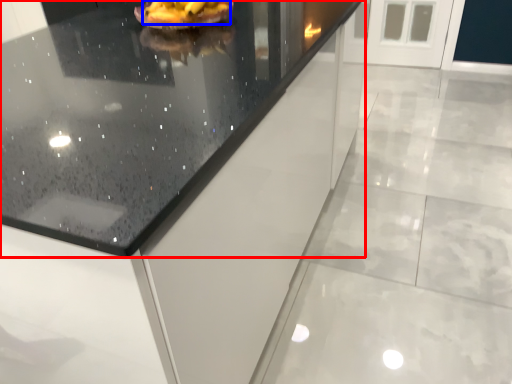
Question: Which of the following is the closest to the observer, countertop (highlighted by a red box) or food (highlighted by a blue box)?

Choices:
 (A) countertop
 (B) food

Answer: (A)